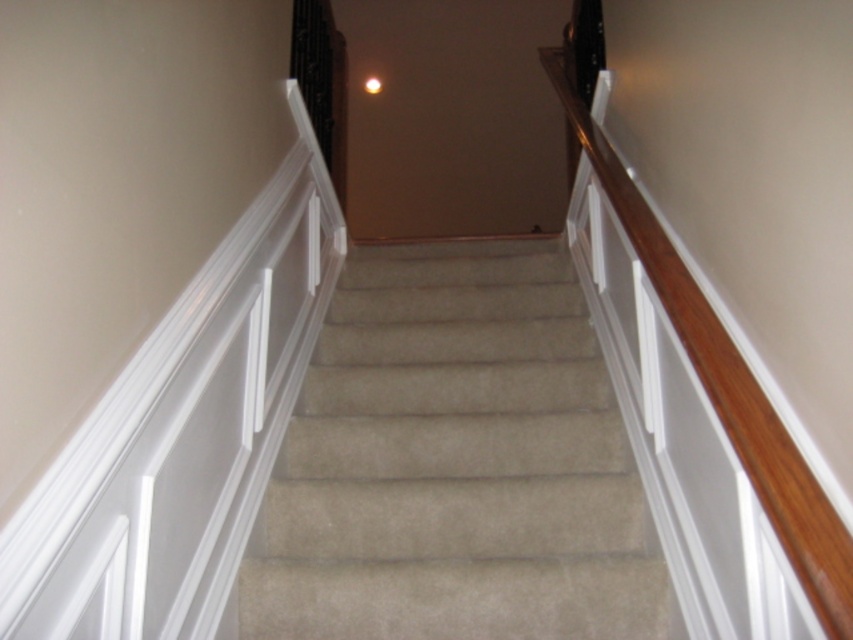
Question: Which point is closer to the camera?

Choices:
 (A) beige carpet at center
 (B) wooden handrail at upper right

Answer: (B)

Question: Does beige carpet at center have a larger size compared to wooden handrail at upper right?

Choices:
 (A) no
 (B) yes

Answer: (A)

Question: Is beige carpet at center wider than wooden handrail at upper right?

Choices:
 (A) yes
 (B) no

Answer: (A)

Question: Which point appears closest to the camera in this image?

Choices:
 (A) (664, 259)
 (B) (399, 516)

Answer: (A)

Question: Can you confirm if beige carpet at center is positioned to the right of wooden handrail at upper right?

Choices:
 (A) yes
 (B) no

Answer: (B)